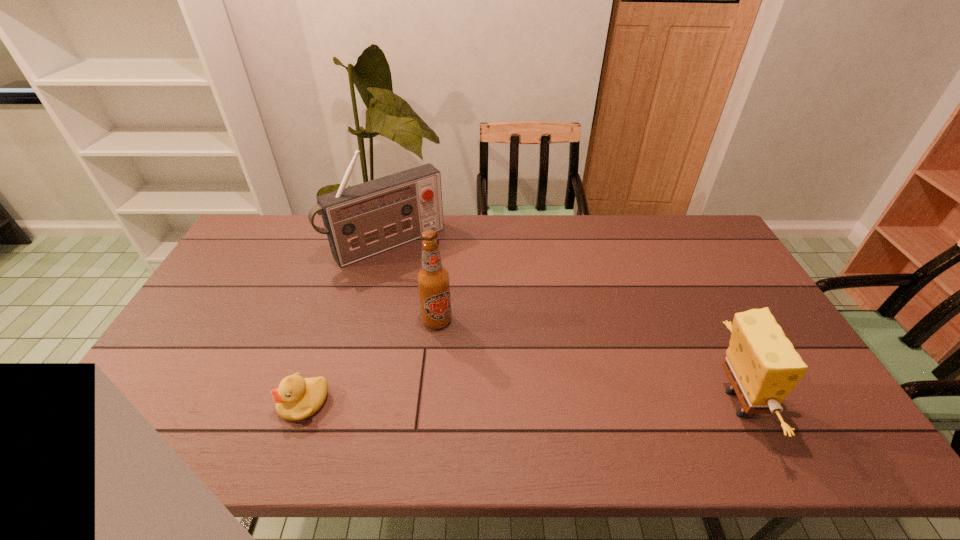
At what (x,y) coordinates should I click in order to perform the action: click on vacant spot on the desktop that is between the duckling and the rightmost object and is positioned on the front panel of the radio receiver. Please return your answer as a coordinate pair (x, y). The width and height of the screenshot is (960, 540). Looking at the image, I should click on (519, 403).

Locate an element on the screen. vacant space on the desktop that is between the shortest object and the third tallest object and is positioned on the front label of the beer bottle is located at coordinates (457, 403).